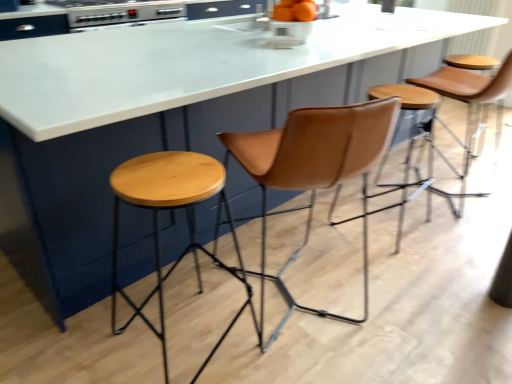
Question: Considering the relative sizes of brown leather swivel chair at center and orange matte bowl at center in the image provided, is brown leather swivel chair at center thinner than orange matte bowl at center?

Choices:
 (A) yes
 (B) no

Answer: (B)

Question: Are brown leather swivel chair at center and orange matte bowl at center making contact?

Choices:
 (A) yes
 (B) no

Answer: (B)

Question: Considering the relative positions of brown leather swivel chair at center and orange matte bowl at center in the image provided, is brown leather swivel chair at center in front of orange matte bowl at center?

Choices:
 (A) no
 (B) yes

Answer: (B)

Question: Considering the relative positions of brown leather swivel chair at center and orange matte bowl at center in the image provided, is brown leather swivel chair at center to the left of orange matte bowl at center from the viewer's perspective?

Choices:
 (A) yes
 (B) no

Answer: (A)

Question: Is brown leather swivel chair at center not inside orange matte bowl at center?

Choices:
 (A) no
 (B) yes

Answer: (B)

Question: Considering the positions of leather stool at center, which ranks as the 1th stool in right-to-left order, and metallic silver oven at upper left in the image, is leather stool at center, which ranks as the 1th stool in right-to-left order, taller or shorter than metallic silver oven at upper left?

Choices:
 (A) tall
 (B) short

Answer: (A)

Question: From the image's perspective, is leather stool at center, which ranks as the 1th stool in right-to-left order, above or below metallic silver oven at upper left?

Choices:
 (A) below
 (B) above

Answer: (A)

Question: Is point (399, 94) closer or farther from the camera than point (139, 18)?

Choices:
 (A) closer
 (B) farther

Answer: (A)

Question: From a real-world perspective, is leather stool at center, the second stool positioned from the left, above or below metallic silver oven at upper left?

Choices:
 (A) below
 (B) above

Answer: (A)

Question: Considering the positions of natural wood stool at left, the first stool from the front, and leather stool at center, the 1th stool from the back, in the image, is natural wood stool at left, the first stool from the front, taller or shorter than leather stool at center, the 1th stool from the back,?

Choices:
 (A) tall
 (B) short

Answer: (B)

Question: In the image, is natural wood stool at left, the first stool from the front, positioned in front of or behind leather stool at center, which ranks as the 1th stool in right-to-left order?

Choices:
 (A) front
 (B) behind

Answer: (A)

Question: Is natural wood stool at left, positioned as the 2th stool in right-to-left order, inside or outside of leather stool at center, which ranks as the 1th stool in right-to-left order?

Choices:
 (A) inside
 (B) outside

Answer: (B)

Question: Looking at the image, does natural wood stool at left, which is the first stool from left to right, seem bigger or smaller compared to leather stool at center, the 1th stool from the back?

Choices:
 (A) big
 (B) small

Answer: (B)

Question: Based on their sizes in the image, would you say metallic silver oven at upper left is bigger or smaller than leather stool at center, the second stool positioned from the left?

Choices:
 (A) small
 (B) big

Answer: (A)

Question: Is metallic silver oven at upper left inside the boundaries of leather stool at center, the second stool positioned from the left, or outside?

Choices:
 (A) inside
 (B) outside

Answer: (B)